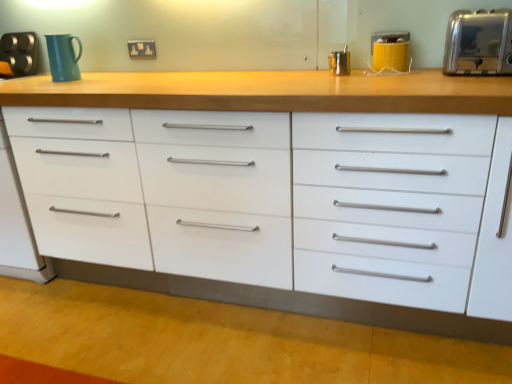
Question: Which is correct: brushed metal toaster at upper left, marked as the fourth appliance in a right-to-left arrangement, is inside matte teal mug at upper left, or outside of it?

Choices:
 (A) inside
 (B) outside

Answer: (B)

Question: Considering the positions of brushed metal toaster at upper left, positioned as the first appliance in left-to-right order, and matte teal mug at upper left in the image, is brushed metal toaster at upper left, positioned as the first appliance in left-to-right order, bigger or smaller than matte teal mug at upper left?

Choices:
 (A) big
 (B) small

Answer: (A)

Question: Which object is the farthest from the brushed metal toaster at upper left, marked as the 4th appliance in a front-to-back arrangement?

Choices:
 (A) matte teal mug at upper left
 (B) white glossy chest of drawers at center
 (C) satin silver toaster at upper right, which is the first appliance from right to left
 (D) yellow matte toaster at upper right, marked as the 3th appliance in a left-to-right arrangement
 (E) matte plastic electric outlet at upper center

Answer: (C)

Question: Estimate the real-world distances between objects in this image. Which object is closer to the white glossy chest of drawers at center?

Choices:
 (A) brushed metal toaster at upper left, positioned as the first appliance in left-to-right order
 (B) satin silver toaster at upper right, which is the 4th appliance from back to front
 (C) matte teal mug at upper left
 (D) metallic silver container at upper center, the 3th appliance when ordered from front to back
 (E) matte plastic electric outlet at upper center

Answer: (D)